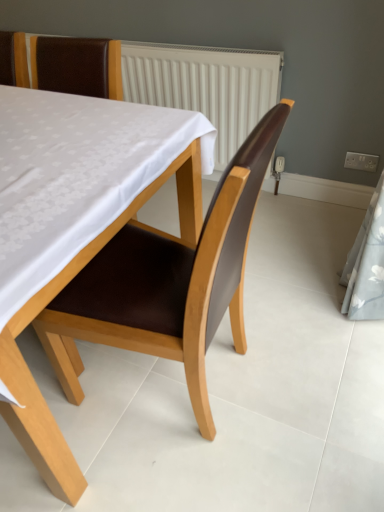
Question: Can you confirm if brown leather chair at center, marked as the 2th chair in a top-to-bottom arrangement, is wider than brown leather chair at upper left, which is the 1th chair from top to bottom?

Choices:
 (A) yes
 (B) no

Answer: (A)

Question: Is brown leather chair at upper left, acting as the second chair starting from the bottom, at the back of brown leather chair at center, the 1th chair ordered from the bottom?

Choices:
 (A) yes
 (B) no

Answer: (B)

Question: From the image's perspective, is brown leather chair at center, marked as the 2th chair in a top-to-bottom arrangement, below brown leather chair at upper left, which is the 1th chair from top to bottom?

Choices:
 (A) no
 (B) yes

Answer: (B)

Question: Can brown leather chair at upper left, which is the 1th chair from top to bottom, be found inside brown leather chair at center, marked as the 2th chair in a top-to-bottom arrangement?

Choices:
 (A) no
 (B) yes

Answer: (A)

Question: Is brown leather chair at center, the 1th chair ordered from the bottom, to the right of brown leather chair at upper left, acting as the second chair starting from the bottom, from the viewer's perspective?

Choices:
 (A) yes
 (B) no

Answer: (A)

Question: Can you see brown leather chair at center, the 1th chair ordered from the bottom, touching brown leather chair at upper left, which is the 1th chair from top to bottom?

Choices:
 (A) no
 (B) yes

Answer: (A)

Question: From a real-world perspective, does brown leather chair at upper left, which is the 1th chair from top to bottom, sit lower than brown leather chair at center, marked as the 2th chair in a top-to-bottom arrangement?

Choices:
 (A) yes
 (B) no

Answer: (B)

Question: From the image's perspective, is brown leather chair at upper left, acting as the second chair starting from the bottom, under brown leather chair at center, the 1th chair ordered from the bottom?

Choices:
 (A) yes
 (B) no

Answer: (B)

Question: Is brown leather chair at upper left, acting as the second chair starting from the bottom, to the left of brown leather chair at center, marked as the 2th chair in a top-to-bottom arrangement, from the viewer's perspective?

Choices:
 (A) no
 (B) yes

Answer: (B)

Question: From the image's perspective, does brown leather chair at upper left, acting as the second chair starting from the bottom, appear higher than brown leather chair at center, marked as the 2th chair in a top-to-bottom arrangement?

Choices:
 (A) yes
 (B) no

Answer: (A)

Question: Is brown leather chair at upper left, acting as the second chair starting from the bottom, wider than brown leather chair at center, marked as the 2th chair in a top-to-bottom arrangement?

Choices:
 (A) no
 (B) yes

Answer: (A)

Question: Can you confirm if brown leather chair at upper left, acting as the second chair starting from the bottom, is smaller than brown leather chair at center, marked as the 2th chair in a top-to-bottom arrangement?

Choices:
 (A) yes
 (B) no

Answer: (A)

Question: From their relative heights in the image, would you say brown leather chair at upper left, acting as the second chair starting from the bottom, is taller or shorter than brown leather chair at center, the 1th chair ordered from the bottom?

Choices:
 (A) short
 (B) tall

Answer: (A)